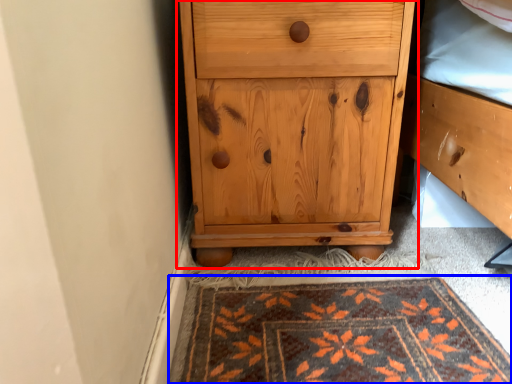
Question: Which object is closer to the camera taking this photo, chest of drawers (highlighted by a red box) or mat (highlighted by a blue box)?

Choices:
 (A) chest of drawers
 (B) mat

Answer: (B)